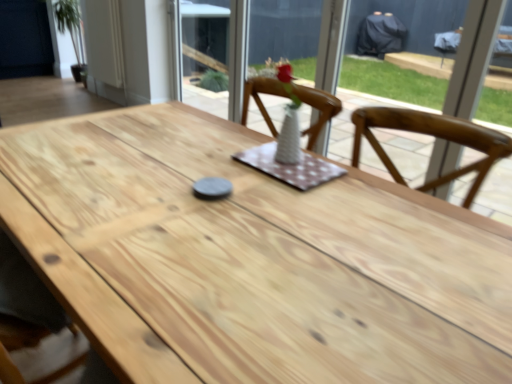
What do you see at coordinates (331, 43) in the screenshot?
I see `white glass vase at upper center` at bounding box center [331, 43].

Where is `white wood door at upper left`? white wood door at upper left is located at coordinates (104, 49).

The image size is (512, 384). I want to click on white glass vase at upper center, so click(331, 43).

Is white wood door at upper left a part of white ceramic vase at center?

Actually, white wood door at upper left is outside white ceramic vase at center.

Considering the sizes of white ceramic vase at center and white wood door at upper left in the image, is white ceramic vase at center taller or shorter than white wood door at upper left?

Clearly, white ceramic vase at center is shorter compared to white wood door at upper left.

Between white ceramic vase at center and white wood door at upper left, which one appears on the right side from the viewer's perspective?

Positioned to the right is white ceramic vase at center.

From a real-world perspective, is white ceramic vase at center located higher than white wood door at upper left?

Correct, in the physical world, white ceramic vase at center is higher than white wood door at upper left.

Is there a large distance between white wood door at upper left and white ceramic vase at center?

That's right, there is a large distance between white wood door at upper left and white ceramic vase at center.

Is point (112, 100) positioned in front of point (257, 101)?

No, (112, 100) is further to viewer.

Where is `chair in front of the white wood door at upper left`? This screenshot has width=512, height=384. chair in front of the white wood door at upper left is located at coordinates (318, 110).

Which object is wider, white wood door at upper left or white ceramic vase at center?

white wood door at upper left.

Between point (362, 362) and point (328, 38), which one is positioned behind?

Positioned behind is point (328, 38).

Considering the positions of objects natural wood table at center and white glass vase at upper center in the image provided, who is more to the left, natural wood table at center or white glass vase at upper center?

natural wood table at center.

Can you tell me how much natural wood table at center and white glass vase at upper center differ in facing direction?

180 degrees separate the facing orientations of natural wood table at center and white glass vase at upper center.

Looking at this image, considering the sizes of objects natural wood table at center and white glass vase at upper center in the image provided, who is wider, natural wood table at center or white glass vase at upper center?

Wider between the two is natural wood table at center.

Is natural wood table at center not within white ceramic vase at center?

That's correct, natural wood table at center is outside of white ceramic vase at center.

Where is `chair that appears on the right of natural wood table at center`? chair that appears on the right of natural wood table at center is located at coordinates (318, 110).

Looking at this image, is natural wood table at center facing away from white ceramic vase at center?

That's not correct — natural wood table at center is not looking away from white ceramic vase at center.

From a real-world perspective, between white wood door at upper left and natural wood table at center, who is vertically lower?

From a 3D spatial view, natural wood table at center is below.

Considering the sizes of white wood door at upper left and natural wood table at center in the image, is white wood door at upper left wider or thinner than natural wood table at center?

In the image, white wood door at upper left appears to be more narrow than natural wood table at center.

Is white wood door at upper left placed right next to natural wood table at center?

There is a gap between white wood door at upper left and natural wood table at center.

Where is `chair above the natural wood table at center (from a real-world perspective)`? This screenshot has width=512, height=384. chair above the natural wood table at center (from a real-world perspective) is located at coordinates (318, 110).

Is white ceramic vase at center bigger or smaller than natural wood table at center?

Clearly, white ceramic vase at center is smaller in size than natural wood table at center.

Considering the positions of objects white ceramic vase at center and natural wood table at center in the image provided, who is in front, white ceramic vase at center or natural wood table at center?

natural wood table at center is more forward.

Would you say white ceramic vase at center is inside or outside natural wood table at center?

white ceramic vase at center lies outside natural wood table at center.

From a real-world perspective, does white wood door at upper left stand above white glass vase at upper center?

No, from a real-world perspective, white wood door at upper left is not over white glass vase at upper center

This screenshot has width=512, height=384. I want to click on door below the white glass vase at upper center (from a real-world perspective), so click(x=104, y=49).

In terms of height, does white wood door at upper left look taller or shorter compared to white glass vase at upper center?

In the image, white wood door at upper left appears to be shorter than white glass vase at upper center.

Between white wood door at upper left and white glass vase at upper center, which one appears on the right side from the viewer's perspective?

From the viewer's perspective, white glass vase at upper center appears more on the right side.

Where is `chair on the right side of white wood door at upper left`? The height and width of the screenshot is (384, 512). chair on the right side of white wood door at upper left is located at coordinates (318, 110).

I want to click on chair that appears in front of the white wood door at upper left, so click(318, 110).

Estimate the real-world distances between objects in this image. Which object is further from white wood door at upper left, white glass vase at upper center or natural wood table at center?

Based on the image, natural wood table at center appears to be further to white wood door at upper left.

Considering their positions, is natural wood table at center positioned closer to white glass vase at upper center than white wood door at upper left?

white wood door at upper left is positioned closer to the anchor white glass vase at upper center.

Considering their positions, is white ceramic vase at center positioned closer to natural wood table at center than white wood door at upper left?

The object closer to natural wood table at center is white ceramic vase at center.

Which object lies further to the anchor point white ceramic vase at center, natural wood table at center or white glass vase at upper center?

Among the two, white glass vase at upper center is located further to white ceramic vase at center.

Looking at this image, from the image, which object appears to be nearer to white glass vase at upper center, white wood door at upper left or white ceramic vase at center?

white wood door at upper left is positioned closer to the anchor white glass vase at upper center.

Based on their spatial positions, is white ceramic vase at center or natural wood table at center further from white glass vase at upper center?

natural wood table at center lies further to white glass vase at upper center than the other object.

Based on their spatial positions, is white glass vase at upper center or white ceramic vase at center closer to white wood door at upper left?

white glass vase at upper center is closer to white wood door at upper left.

In the scene shown: From the image, which object appears to be farther from white wood door at upper left, natural wood table at center or white ceramic vase at center?

The object further to white wood door at upper left is natural wood table at center.

Where is `screen door between white ceramic vase at center and white wood door at upper left from front to back`? This screenshot has height=384, width=512. screen door between white ceramic vase at center and white wood door at upper left from front to back is located at coordinates (331, 43).

This screenshot has height=384, width=512. Identify the location of chair between natural wood table at center and white glass vase at upper center along the z-axis. (318, 110).

Find the location of `chair positioned between natural wood table at center and white wood door at upper left from near to far`. chair positioned between natural wood table at center and white wood door at upper left from near to far is located at coordinates (318, 110).

Identify the location of screen door located between natural wood table at center and white wood door at upper left in the depth direction. The height and width of the screenshot is (384, 512). (331, 43).